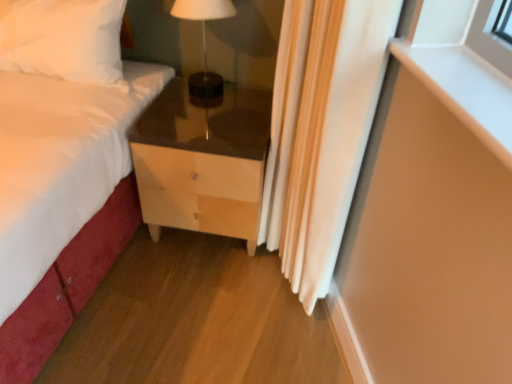
The image size is (512, 384). In order to click on free space in front of matte wood chest of drawers at lower center in this screenshot , I will do pyautogui.click(x=187, y=303).